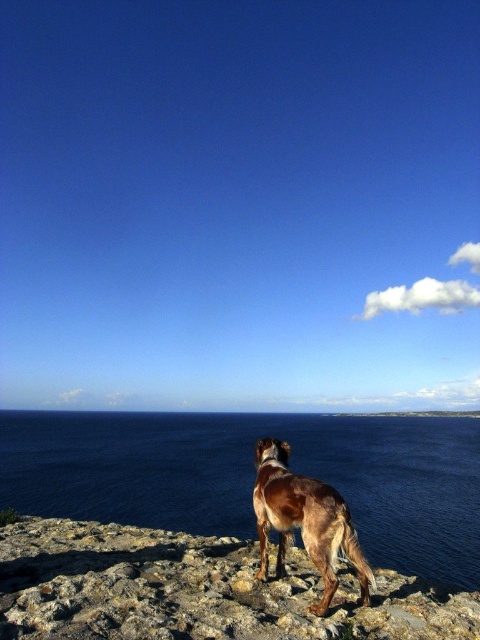
Which is in front, point (447, 536) or point (358, 561)?

Point (358, 561) is in front.

Does point (79, 454) come in front of point (333, 557)?

No.

Does point (86, 470) lie behind point (271, 461)?

Yes, point (86, 470) is farther from viewer.

What are the coordinates of `blue water at lower center` in the screenshot? It's located at (252, 476).